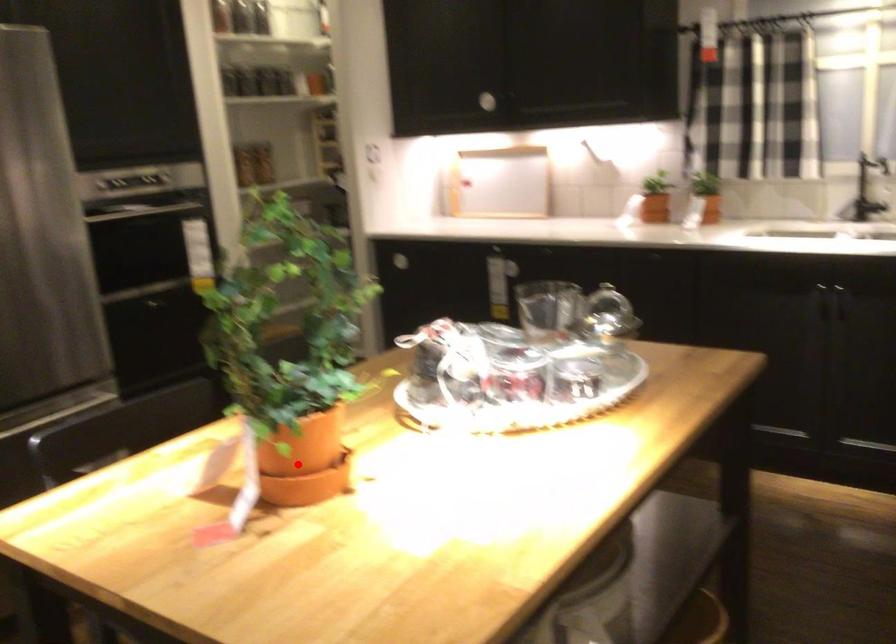
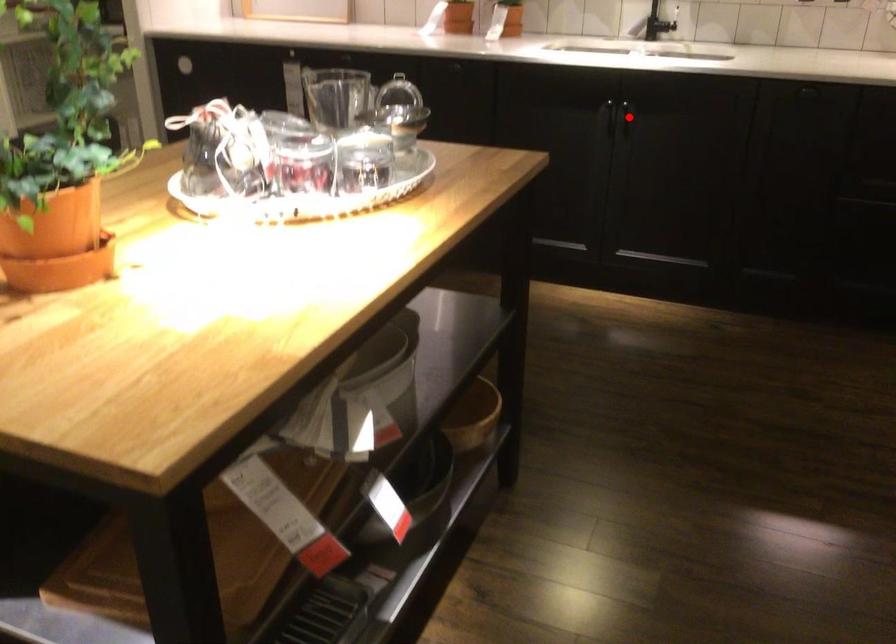
I am providing you with two images of the same scene from different viewpoints. A red point is marked on the first image and another point is marked on the second image. Is the red point in image1 aligned with the point shown in image2?

No